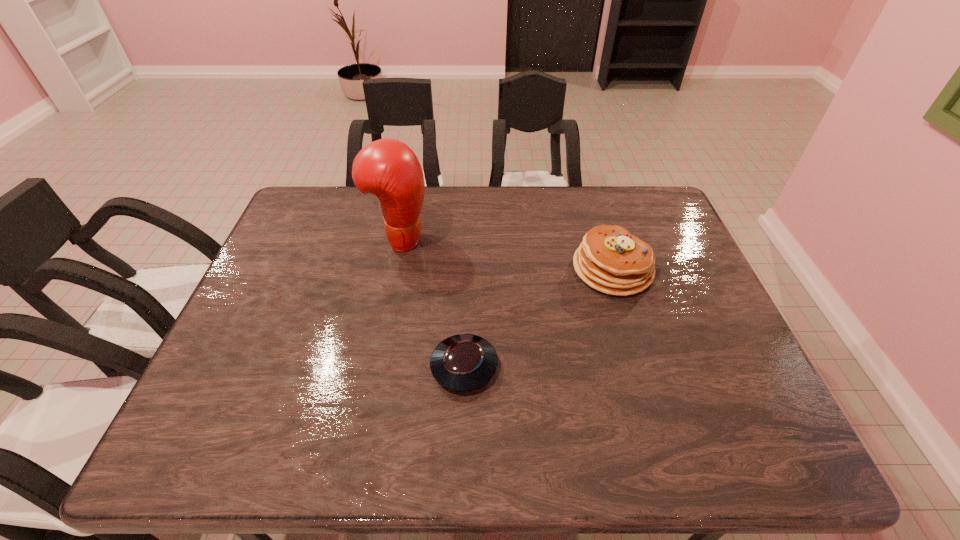
This screenshot has height=540, width=960. Identify the location of free spot that satisfies the following two spatial constraints: 1. on the striking surface of the rightmost object; 2. on the left side of the leftmost object. (394, 269).

Where is `free space that satisfies the following two spatial constraints: 1. on the striking surface of the boxing glove; 2. on the right side of the nearest object`? free space that satisfies the following two spatial constraints: 1. on the striking surface of the boxing glove; 2. on the right side of the nearest object is located at coordinates (374, 367).

The image size is (960, 540). In order to click on vacant point that satisfies the following two spatial constraints: 1. on the back side of the rightmost object; 2. on the striking surface of the leftmost object in this screenshot , I will do `click(603, 239)`.

At what (x,y) coordinates should I click in order to perform the action: click on vacant space that satisfies the following two spatial constraints: 1. on the striking surface of the leftmost object; 2. on the back side of the nearest object. Please return your answer as a coordinate pair (x, y). This screenshot has width=960, height=540. Looking at the image, I should click on (374, 367).

Identify the location of vacant area that satisfies the following two spatial constraints: 1. on the striking surface of the boxing glove; 2. on the right side of the nearest object. (374, 367).

What are the coordinates of `vacant area that satisfies the following two spatial constraints: 1. on the striking surface of the second object from left to right; 2. on the right side of the boxing glove` in the screenshot? It's located at (374, 367).

Locate an element on the screen. The height and width of the screenshot is (540, 960). vacant space that satisfies the following two spatial constraints: 1. on the striking surface of the leftmost object; 2. on the back side of the rightmost object is located at coordinates (394, 269).

At what (x,y) coordinates should I click in order to perform the action: click on free space that satisfies the following two spatial constraints: 1. on the striking surface of the shortest object; 2. on the right side of the boxing glove. Please return your answer as a coordinate pair (x, y). Looking at the image, I should click on (374, 367).

Where is `free space that satisfies the following two spatial constraints: 1. on the striking surface of the boxing glove; 2. on the left side of the shortest object`? This screenshot has height=540, width=960. free space that satisfies the following two spatial constraints: 1. on the striking surface of the boxing glove; 2. on the left side of the shortest object is located at coordinates (374, 367).

Image resolution: width=960 pixels, height=540 pixels. Identify the location of vacant area that satisfies the following two spatial constraints: 1. on the striking surface of the tallest object; 2. on the left side of the nearest object. (374, 367).